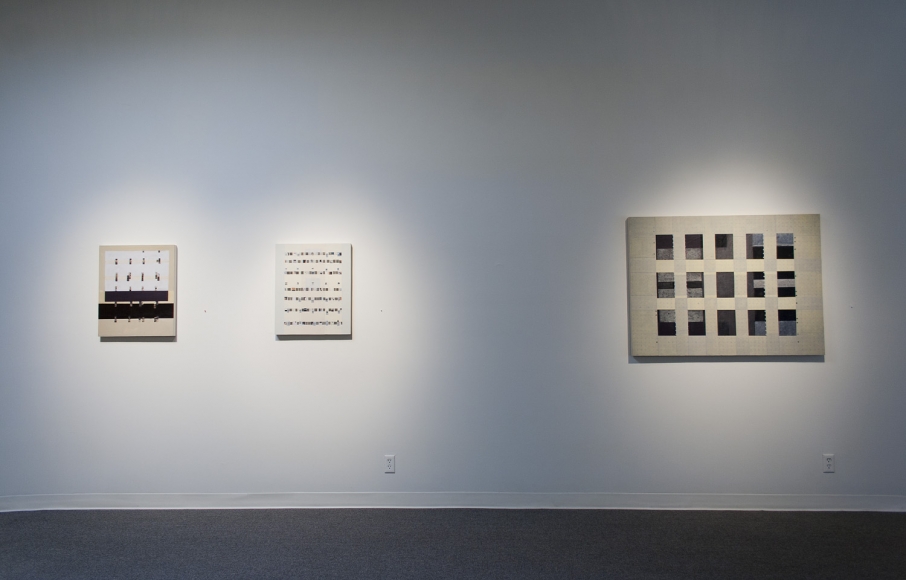
The width and height of the screenshot is (906, 580). Identify the location of lit area. coord(213,293), coord(729,200).